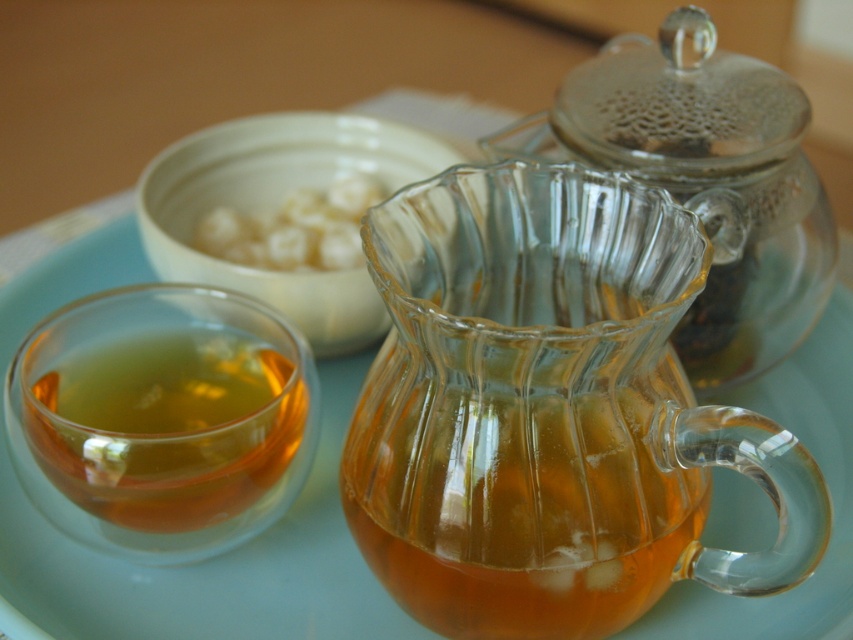
Is point (491, 365) positioned in front of point (564, 93)?

Yes, point (491, 365) is closer to viewer.

Is point (386, 429) positioned before point (715, 80)?

Yes, point (386, 429) is closer to viewer.

You are a GUI agent. You are given a task and a screenshot of the screen. Output one action in this format:
    pyautogui.click(x=<x>, y=<y>)
    Task: Click on the transparent glass carafe at center
    
    Given the screenshot: What is the action you would take?
    pyautogui.click(x=550, y=412)

This screenshot has height=640, width=853. Describe the element at coordinates (276, 204) in the screenshot. I see `white matte bowl at upper center` at that location.

Where is `white matte bowl at upper center`? white matte bowl at upper center is located at coordinates 276,204.

In the scene shown: Between translucent glass cup at left and white matte bowl at upper center, which one has less height?

translucent glass cup at left is shorter.

You are a GUI agent. You are given a task and a screenshot of the screen. Output one action in this format:
    pyautogui.click(x=<x>, y=<y>)
    Task: Click on the translucent glass cup at left
    
    Given the screenshot: What is the action you would take?
    pyautogui.click(x=166, y=428)